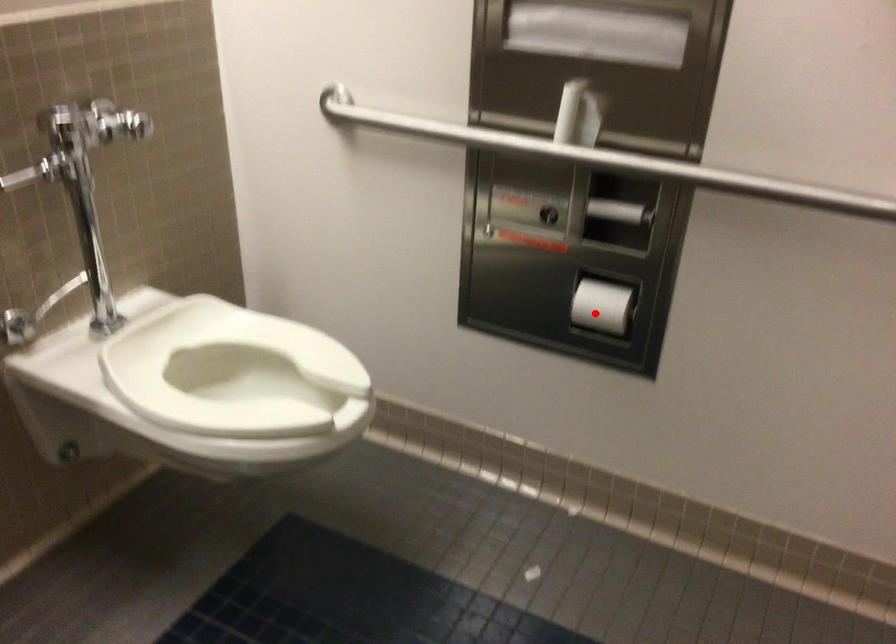
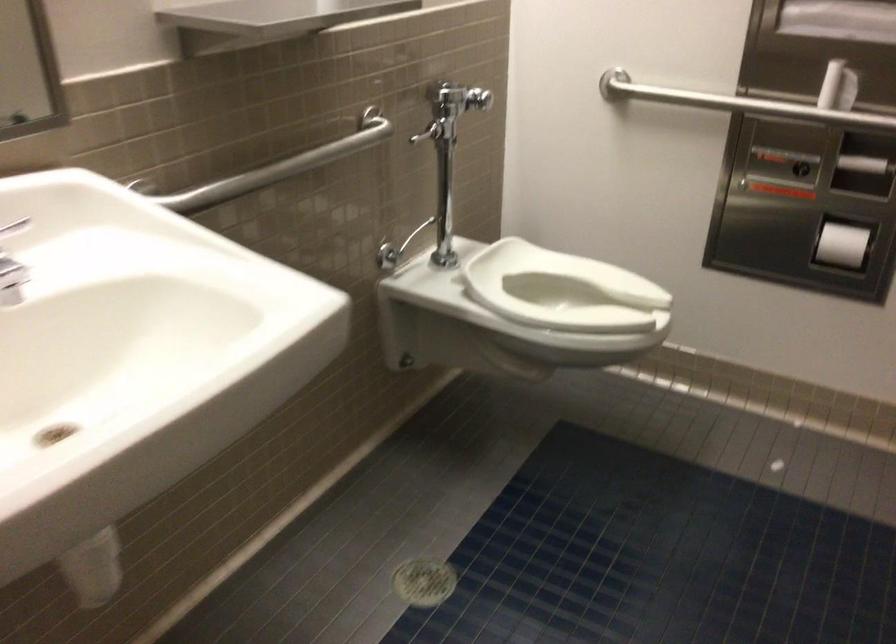
Question: A red point is marked in image1. In image2, is the corresponding 3D point closer to the camera or farther? Reply with the corresponding letter.

Choices:
 (A) The corresponding 3D point is closer.
 (B) The corresponding 3D point is farther.

Answer: (B)